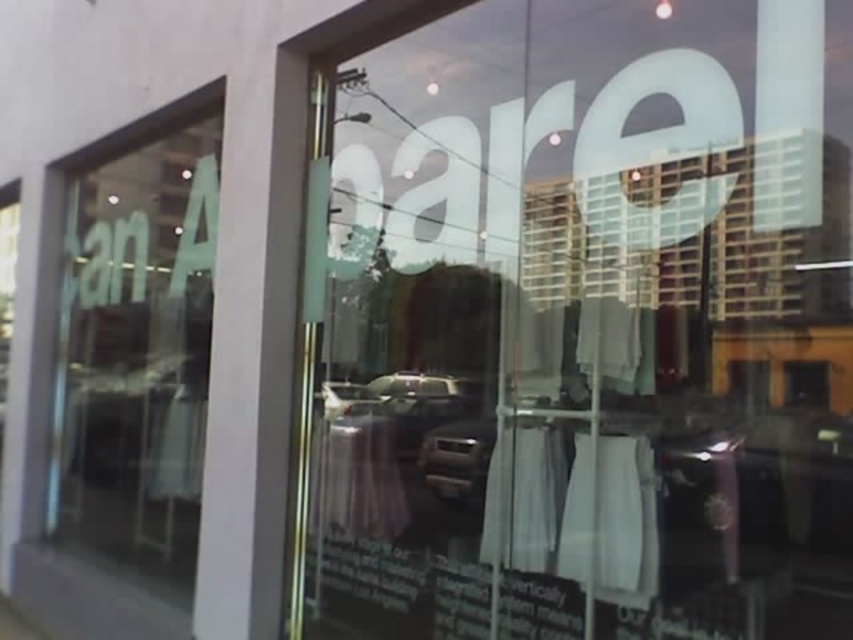
Which of these two, transparent glass display at center or metallic silver car at center, stands taller?

transparent glass display at center

Does transparent glass display at center have a greater height compared to metallic silver car at center?

Correct, transparent glass display at center is much taller as metallic silver car at center.

Does point (422, 561) come farther from viewer compared to point (480, 499)?

No, it is in front of (480, 499).

Where is `transparent glass display at center`? The image size is (853, 640). transparent glass display at center is located at coordinates (585, 324).

Is transparent glass window at upper left to the left of metallic silver car at center from the viewer's perspective?

Correct, you'll find transparent glass window at upper left to the left of metallic silver car at center.

Is point (120, 490) farther from viewer compared to point (437, 435)?

That is False.

Locate an element on the screen. This screenshot has width=853, height=640. transparent glass window at upper left is located at coordinates (135, 368).

This screenshot has width=853, height=640. Find the location of `transparent glass window at upper left`. transparent glass window at upper left is located at coordinates (135, 368).

Looking at this image, is transparent glass display at center positioned at the back of transparent glass window at upper left?

Yes.

Is transparent glass display at center to the left of transparent glass window at upper left from the viewer's perspective?

In fact, transparent glass display at center is to the right of transparent glass window at upper left.

This screenshot has width=853, height=640. Describe the element at coordinates (585, 324) in the screenshot. I see `transparent glass display at center` at that location.

This screenshot has height=640, width=853. Identify the location of transparent glass display at center. (585, 324).